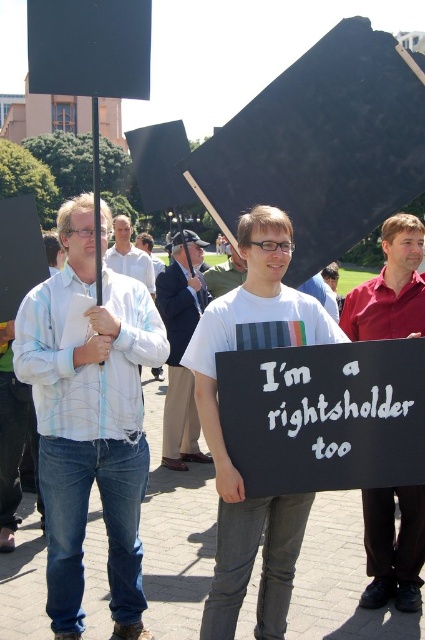
Does dark blue suit at center have a smaller size compared to white shirt at center?

Correct, dark blue suit at center occupies less space than white shirt at center.

Find the location of a particular element. dark blue suit at center is located at coordinates (181, 349).

Who is taller, light blue striped shirt at center or white matte t-shirt at center?

light blue striped shirt at center is taller.

Is the position of light blue striped shirt at center more distant than that of white matte t-shirt at center?

No, light blue striped shirt at center is in front of white matte t-shirt at center.

Is point (130, 380) farther from camera compared to point (331, 330)?

Yes, it is behind point (331, 330).

Where is `light blue striped shirt at center`? light blue striped shirt at center is located at coordinates (90, 420).

Locate an element on the screen. Image resolution: width=425 pixels, height=640 pixels. light blue striped shirt at center is located at coordinates (90, 420).

Between point (124, 420) and point (173, 458), which one is positioned in front?

Positioned in front is point (124, 420).

This screenshot has width=425, height=640. What do you see at coordinates (90, 420) in the screenshot?
I see `light blue striped shirt at center` at bounding box center [90, 420].

Find the location of `light blue striped shirt at center`. light blue striped shirt at center is located at coordinates (90, 420).